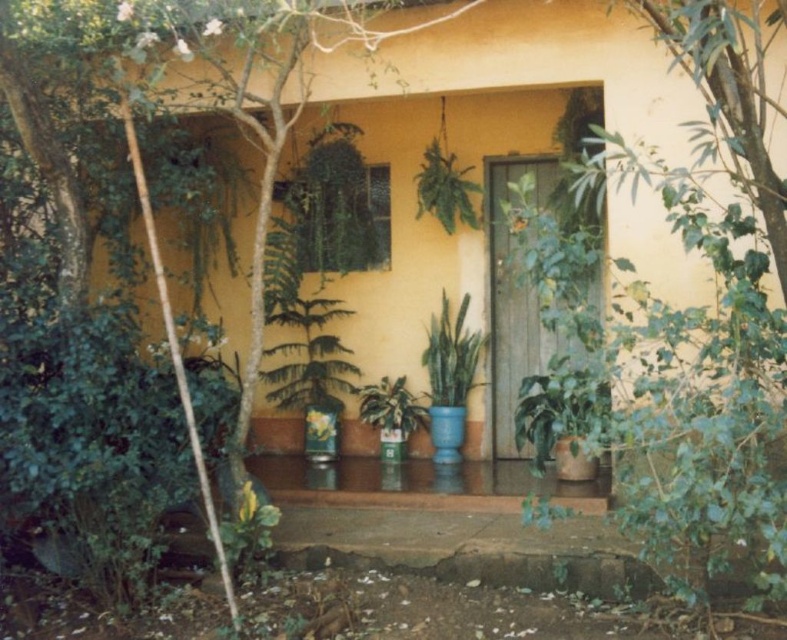
Question: Is green leafy tree at center smaller than green leafy plant at center?

Choices:
 (A) yes
 (B) no

Answer: (B)

Question: Which of the following is the farthest from the observer?

Choices:
 (A) green leafy tree at center
 (B) green leafy plant at center

Answer: (B)

Question: Considering the relative positions of green leafy tree at center and green leafy plant at center in the image provided, where is green leafy tree at center located with respect to green leafy plant at center?

Choices:
 (A) above
 (B) below

Answer: (B)

Question: Which of the following is the farthest from the observer?

Choices:
 (A) green leafy plant at center
 (B) green leafy tree at center

Answer: (A)

Question: Can you confirm if green leafy tree at center is smaller than green leafy plant at center?

Choices:
 (A) no
 (B) yes

Answer: (A)